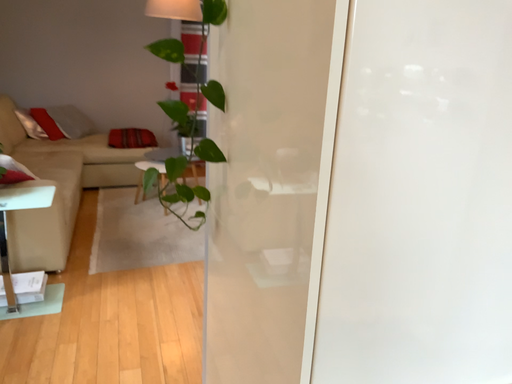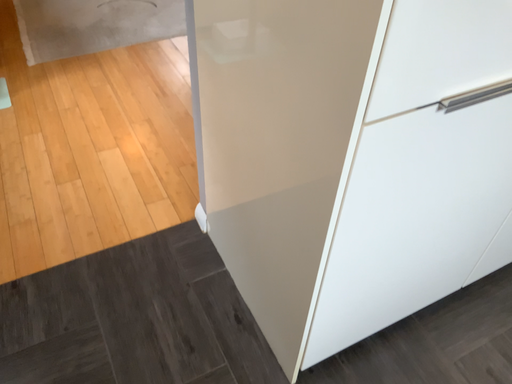
Question: How did the camera likely rotate when shooting the video?

Choices:
 (A) rotated right
 (B) rotated left

Answer: (A)